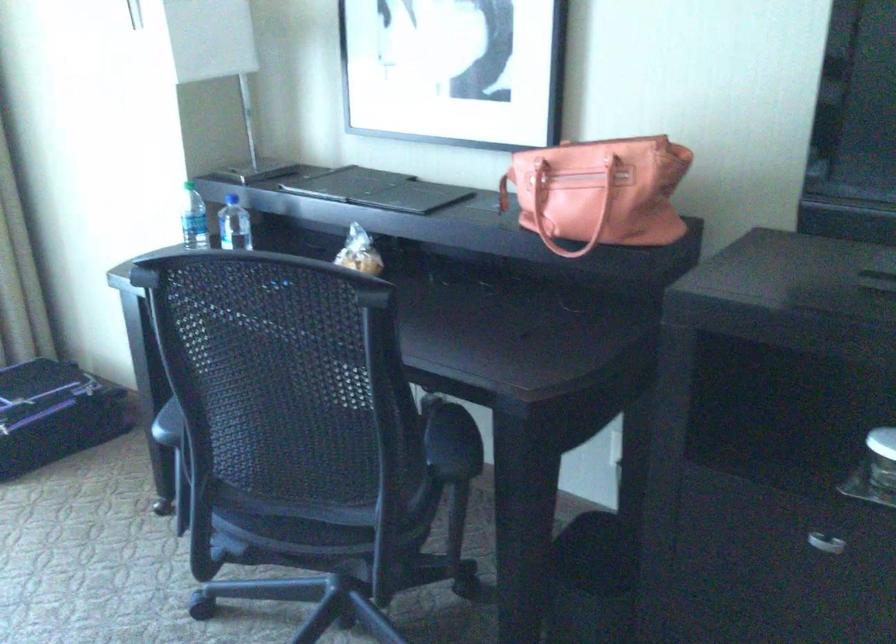
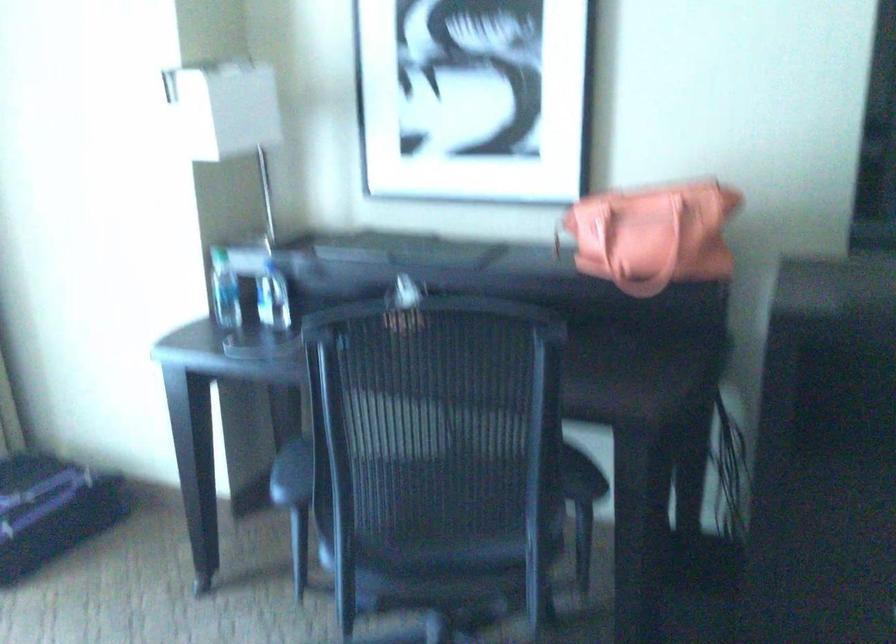
Question: The first image is from the beginning of the video and the second image is from the end. How did the camera likely rotate when shooting the video?

Choices:
 (A) Left
 (B) Right
 (C) Up
 (D) Down

Answer: (B)